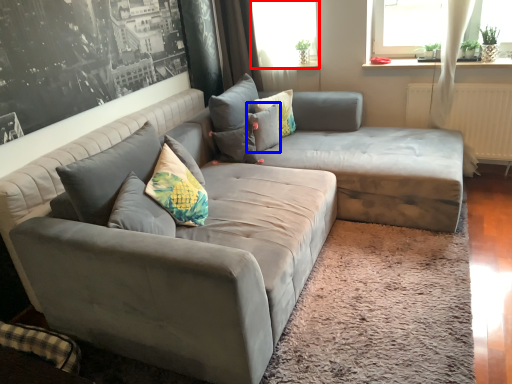
Question: Among these objects, which one is nearest to the camera, window screen (highlighted by a red box) or pillow (highlighted by a blue box)?

Choices:
 (A) window screen
 (B) pillow

Answer: (B)